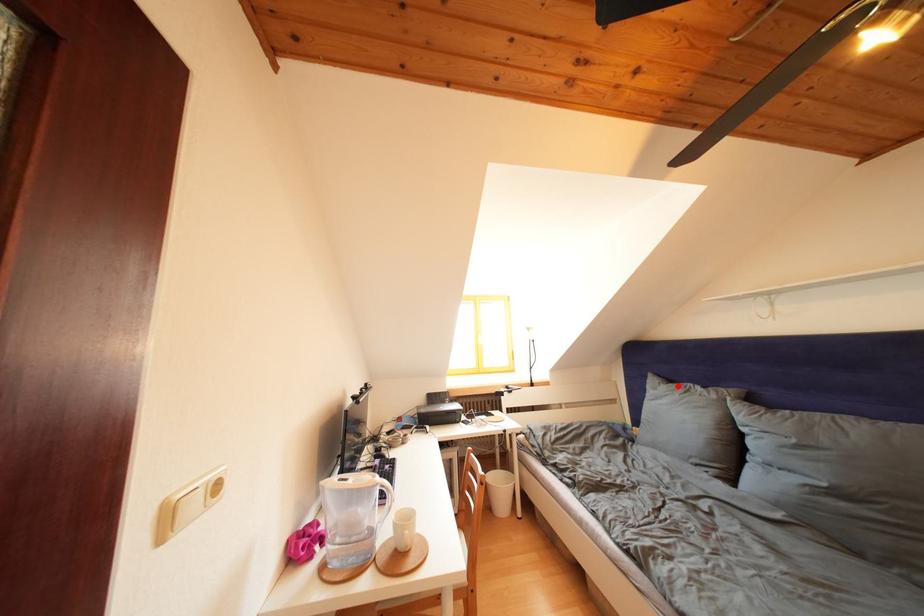
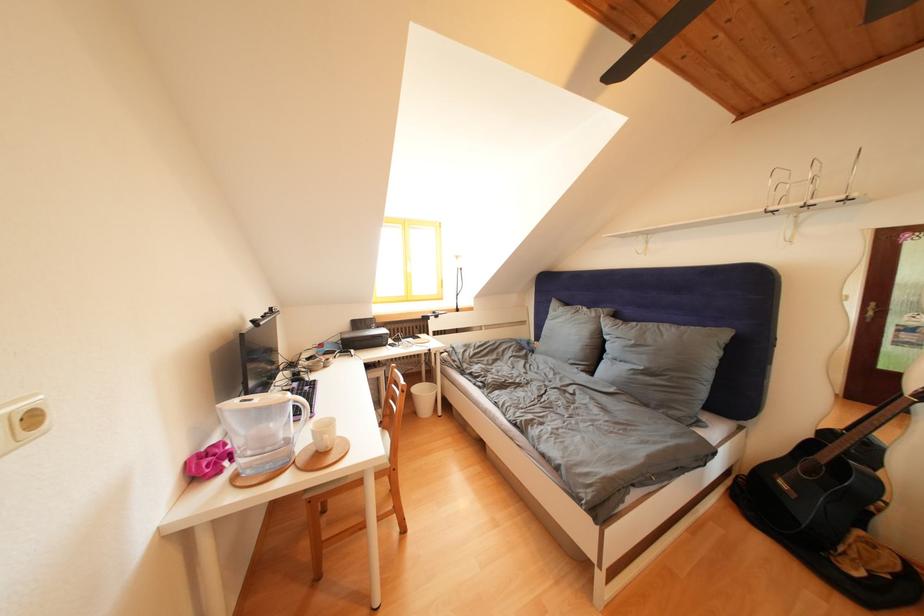
The point at the highlighted location is marked in the first image. Where is the corresponding point in the second image?

(575, 310)